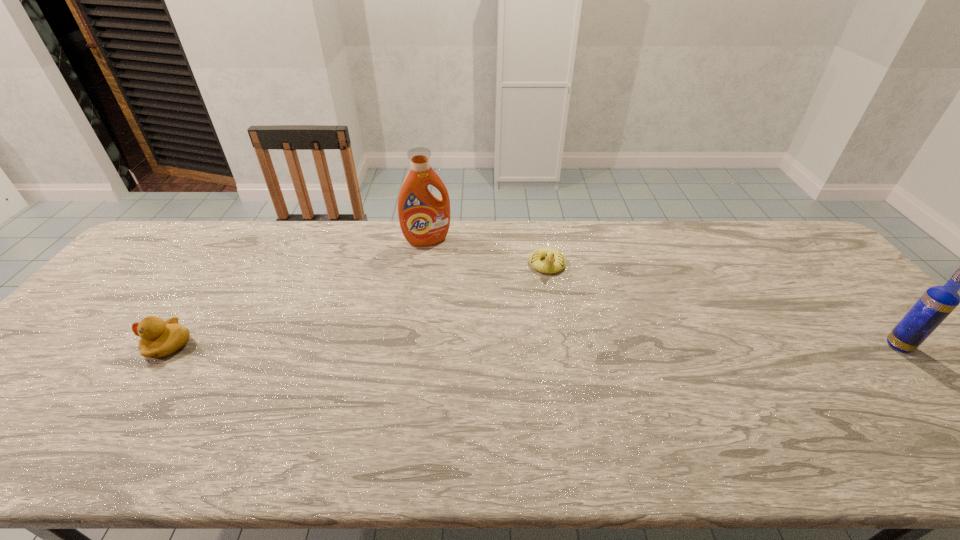
You are a GUI agent. You are given a task and a screenshot of the screen. Output one action in this format:
    pyautogui.click(x=<x>, y=<y>)
    Task: Click on the vacant spot on the desktop that is between the taller duckling and the rightmost object and is positioned on the face of the second farthest object
    Image resolution: width=960 pixels, height=540 pixels.
    Given the screenshot: What is the action you would take?
    pyautogui.click(x=545, y=345)

Find the location of a particular element. Image resolution: width=960 pixels, height=540 pixels. free space on the desktop that is between the second shortest object and the second tallest object and is positioned on the front-facing side of the tallest object is located at coordinates (470, 345).